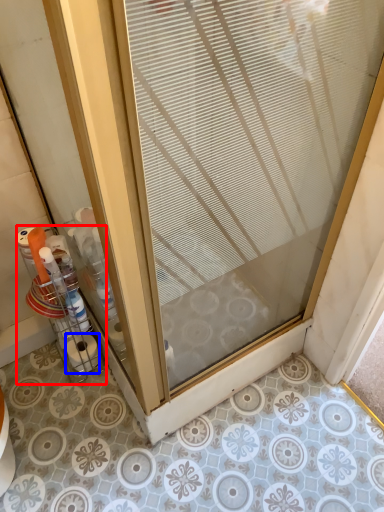
Question: Which point is closer to the camera, glass box (highlighted by a red box) or toilet paper (highlighted by a blue box)?

Choices:
 (A) glass box
 (B) toilet paper

Answer: (A)